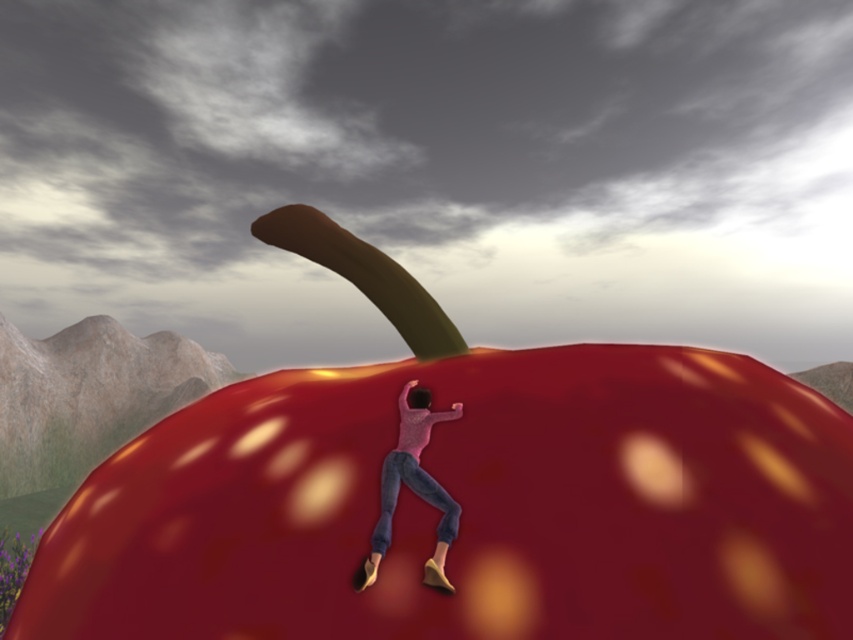
Consider the image. Does glossy red apple at center have a greater height compared to matte pink sweater at center?

Yes, glossy red apple at center is taller than matte pink sweater at center.

From the picture: Who is higher up, glossy red apple at center or matte pink sweater at center?

glossy red apple at center

Which is in front, point (488, 556) or point (381, 522)?

Point (488, 556)

I want to click on glossy red apple at center, so click(463, 493).